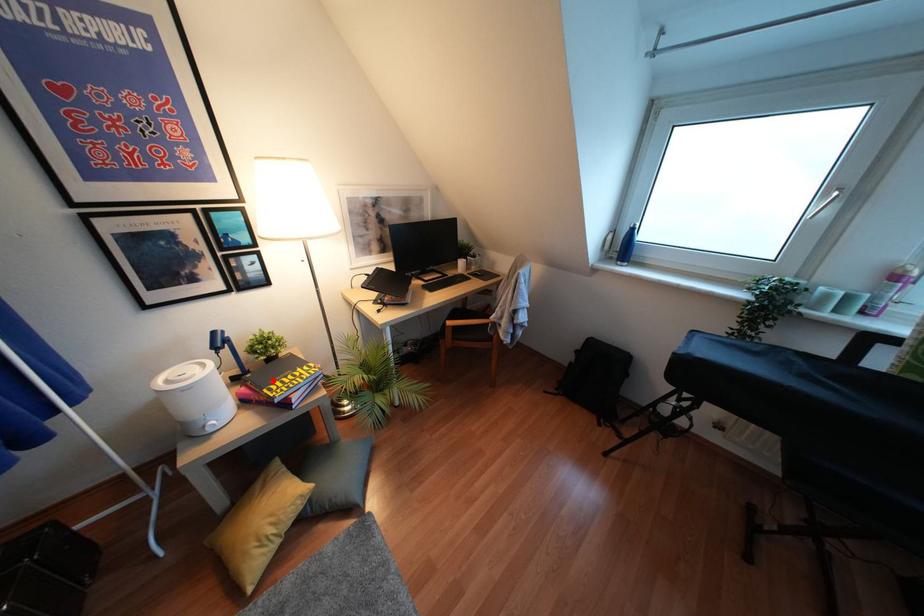
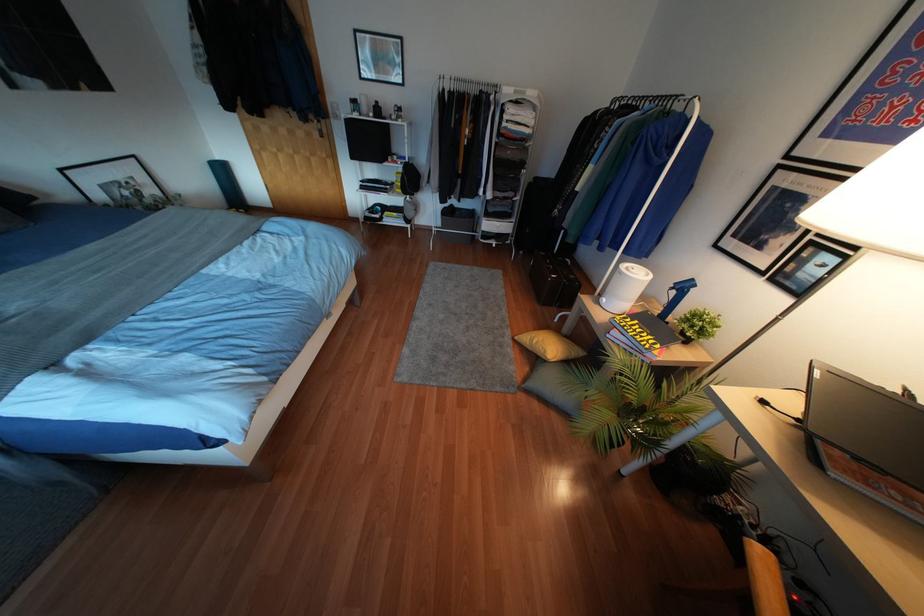
Question: I am providing you with two images of the same scene from different viewpoints. Given a red point in image1, look at the same physical point in image2. Is it:

Choices:
 (A) Closer to the viewpoint
 (B) Farther from the viewpoint

Answer: (A)